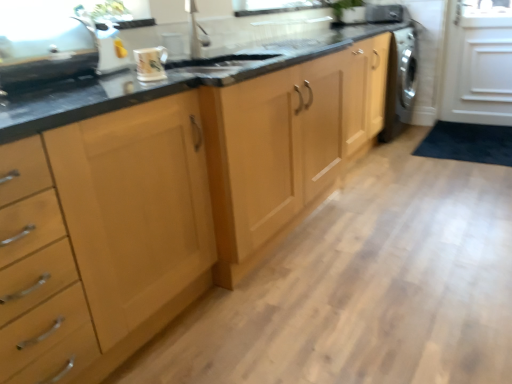
Question: From a real-world perspective, is satin silver dishwasher at right, which is counted as the 1th appliance, starting from the top, physically located above or below glossy ceramic mug at upper center?

Choices:
 (A) below
 (B) above

Answer: (B)

Question: Is satin silver dishwasher at right, which ranks as the 1th appliance in right-to-left order, to the left or to the right of glossy ceramic mug at upper center in the image?

Choices:
 (A) left
 (B) right

Answer: (B)

Question: Estimate the real-world distances between objects in this image. Which object is closer to the satin silver sink at upper left, which is the third appliance in right-to-left order?

Choices:
 (A) metallic silver kettle at upper left, the second appliance viewed from the right
 (B) satin silver dishwasher at right, which is counted as the 1th appliance, starting from the top
 (C) green leafy plant at upper center
 (D) glossy ceramic mug at upper center

Answer: (A)

Question: Which of these objects is positioned farthest from the glossy ceramic mug at upper center?

Choices:
 (A) satin silver dishwasher at right, which is counted as the 3th appliance, starting from the bottom
 (B) metallic silver kettle at upper left, which is counted as the 2th appliance, starting from the back
 (C) green leafy plant at upper center
 (D) satin silver sink at upper left, which appears as the 1th appliance when viewed from the left

Answer: (A)